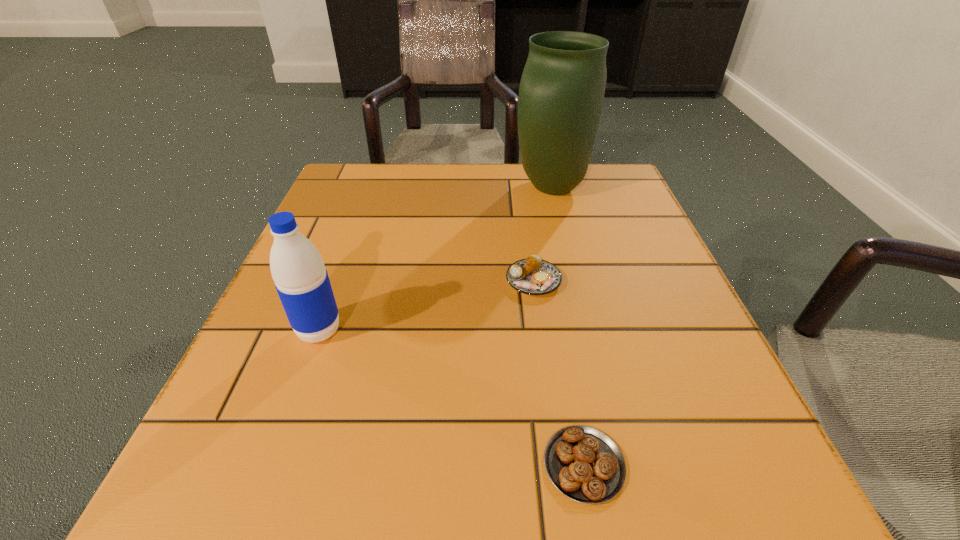
Where is `vacant space situated 0.140m on the left of the farther pastry`? vacant space situated 0.140m on the left of the farther pastry is located at coordinates (427, 281).

Image resolution: width=960 pixels, height=540 pixels. I want to click on free region located on the back of the shortest object, so click(x=544, y=246).

Where is `object positioned at the far edge`? object positioned at the far edge is located at coordinates (561, 93).

This screenshot has height=540, width=960. In order to click on object that is at the near edge in this screenshot , I will do `click(584, 464)`.

Where is `object present at the left edge`? object present at the left edge is located at coordinates (301, 280).

In order to click on object located at the right edge in this screenshot , I will do `click(561, 93)`.

You are a GUI agent. You are given a task and a screenshot of the screen. Output one action in this format:
    pyautogui.click(x=<x>, y=<y>)
    Task: Click on the object at the far right corner
    This screenshot has height=540, width=960.
    Given the screenshot: What is the action you would take?
    pyautogui.click(x=561, y=93)

Find the location of a particular element. This screenshot has height=540, width=960. free space at the far edge is located at coordinates click(405, 203).

The height and width of the screenshot is (540, 960). In order to click on vacant point at the left edge in this screenshot , I will do `click(277, 294)`.

The image size is (960, 540). Find the location of `free space at the right edge of the desktop`. free space at the right edge of the desktop is located at coordinates click(x=607, y=295).